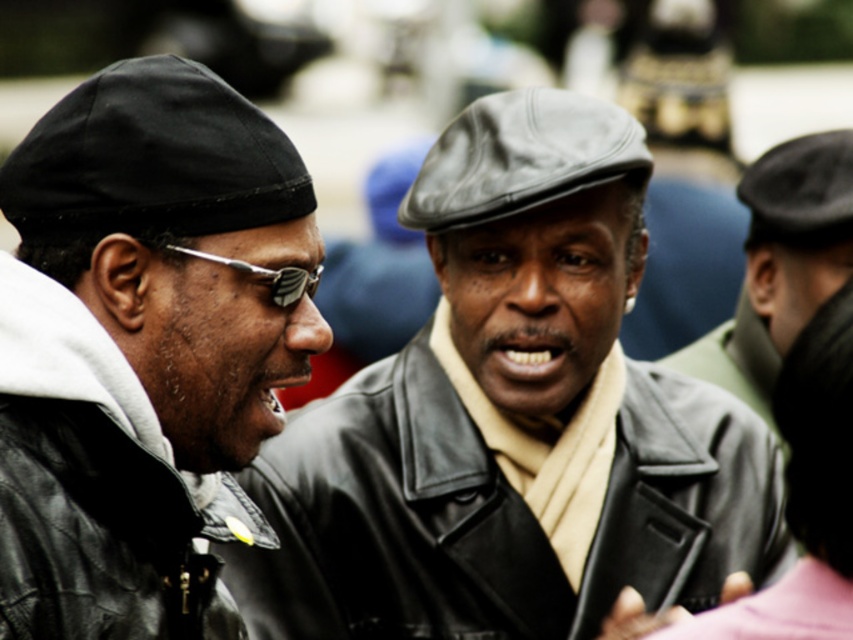
You are a photographer trying to capture a candid shot of two people in an urban setting. You notice the black leather jacket at center and the black leather jacket at left. Which jacket is closer to the right side of the frame?

The black leather jacket at center is positioned on the right side of the black leather jacket at left, so the black leather jacket at center is closer to the right side of the frame.

You are a photographer trying to capture a candid shot of the two people in the scene. You want to ensure that both points, point [387,508] and point [144,570], are in focus. Which point should you focus on to ensure both are sharp?

You should focus on point [387,508] because it is closer to the viewer than point [144,570]. By focusing on the closer point, the depth of field will extend backward, increasing the chances of both points being in focus.

You are a photographer trying to capture a candid shot of both the black leather jacket at center and the leather cap at right. Since you want to ensure both are in focus, which object should you focus on first according to their positions?

The black leather jacket at center is in front of the leather cap at right, so you should focus on the black leather jacket at center first to ensure both are in focus.